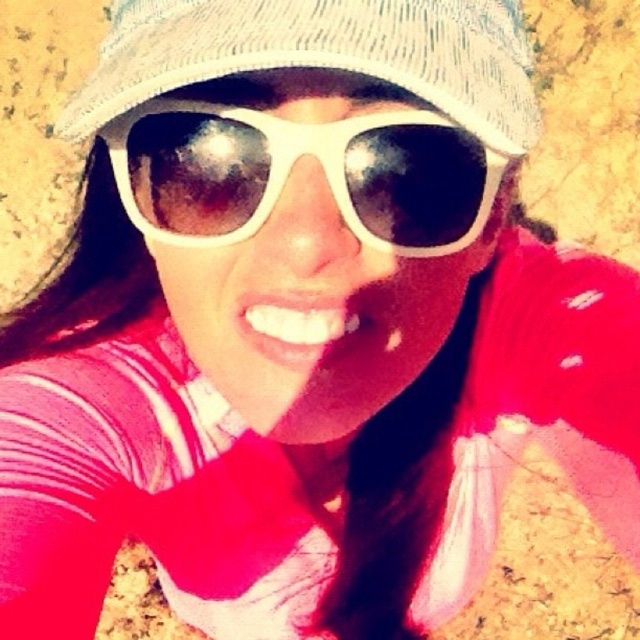
Question: Which of the following is the farthest from the observer?

Choices:
 (A) (499, 147)
 (B) (371, 205)

Answer: (B)

Question: Does white plastic sunglasses at center appear under woven fabric baseball hat at upper center?

Choices:
 (A) no
 (B) yes

Answer: (B)

Question: Which of the following is the closest to the observer?

Choices:
 (A) woven fabric baseball hat at upper center
 (B) white plastic sunglasses at center

Answer: (A)

Question: Which object appears farthest from the camera in this image?

Choices:
 (A) white plastic sunglasses at center
 (B) woven fabric baseball hat at upper center

Answer: (A)

Question: Observing the image, what is the correct spatial positioning of white plastic sunglasses at center in reference to woven fabric baseball hat at upper center?

Choices:
 (A) right
 (B) left

Answer: (B)

Question: Is white plastic sunglasses at center closer to the viewer compared to woven fabric baseball hat at upper center?

Choices:
 (A) no
 (B) yes

Answer: (A)